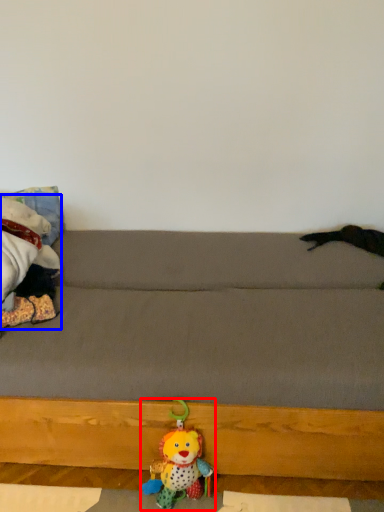
Question: Which point is closer to the camera, toy (highlighted by a red box) or toy (highlighted by a blue box)?

Choices:
 (A) toy
 (B) toy

Answer: (A)